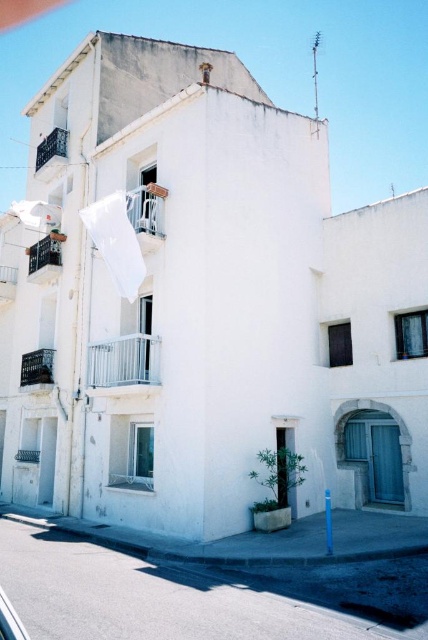
Who is positioned more to the left, white metal balcony at upper left or metallic balcony at upper left?

metallic balcony at upper left

Which is below, white metal balcony at upper left or metallic balcony at upper left?

white metal balcony at upper left

You are a GUI agent. You are given a task and a screenshot of the screen. Output one action in this format:
    pyautogui.click(x=<x>, y=<y>)
    Task: Click on the white metal balcony at upper left
    This screenshot has height=640, width=428.
    Given the screenshot: What is the action you would take?
    pyautogui.click(x=146, y=214)

The height and width of the screenshot is (640, 428). In order to click on white metal balcony at upper left in this screenshot , I will do `click(146, 214)`.

Is point (33, 355) less distant than point (65, 132)?

Yes, it is in front of point (65, 132).

Where is `smooth white balcony at lower left`? smooth white balcony at lower left is located at coordinates (36, 368).

Is metallic balcony at left smaller than metallic balcony at upper left?

No.

Which of these two, metallic balcony at left or metallic balcony at upper left, stands shorter?

metallic balcony at upper left is shorter.

Between point (30, 250) and point (65, 138), which one is positioned in front?

Positioned in front is point (30, 250).

You are a GUI agent. You are given a task and a screenshot of the screen. Output one action in this format:
    pyautogui.click(x=<x>, y=<y>)
    Task: Click on the metallic balcony at left
    The height and width of the screenshot is (640, 428).
    Given the screenshot: What is the action you would take?
    pyautogui.click(x=44, y=257)